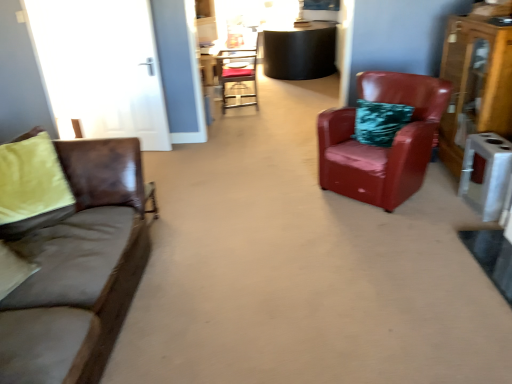
Question: From a real-world perspective, is brown leather couch at left located beneath wooden dresser at right?

Choices:
 (A) no
 (B) yes

Answer: (B)

Question: Can you confirm if brown leather couch at left is bigger than wooden dresser at right?

Choices:
 (A) yes
 (B) no

Answer: (A)

Question: Is wooden dresser at right a part of brown leather couch at left?

Choices:
 (A) yes
 (B) no

Answer: (B)

Question: From the image's perspective, is brown leather couch at left located above wooden dresser at right?

Choices:
 (A) no
 (B) yes

Answer: (A)

Question: Is brown leather couch at left oriented towards wooden dresser at right?

Choices:
 (A) no
 (B) yes

Answer: (B)

Question: In terms of width, does metallic silver chair at center, acting as the second chair starting from the front, look wider or thinner when compared to brown leather couch at left?

Choices:
 (A) thin
 (B) wide

Answer: (A)

Question: From the image's perspective, is metallic silver chair at center, which appears as the second chair when viewed from the right, positioned above or below brown leather couch at left?

Choices:
 (A) below
 (B) above

Answer: (B)

Question: Is point (227, 79) closer or farther from the camera than point (120, 251)?

Choices:
 (A) farther
 (B) closer

Answer: (A)

Question: Would you say metallic silver chair at center, which appears as the second chair when viewed from the right, is to the left or to the right of brown leather couch at left in the picture?

Choices:
 (A) right
 (B) left

Answer: (A)

Question: Considering the positions of leather armchair at right, which is the first chair in right-to-left order, and metallic silver chair at center, which appears as the second chair when viewed from the right, in the image, is leather armchair at right, which is the first chair in right-to-left order, taller or shorter than metallic silver chair at center, which appears as the second chair when viewed from the right,?

Choices:
 (A) tall
 (B) short

Answer: (B)

Question: Is point (318, 153) closer or farther from the camera than point (220, 77)?

Choices:
 (A) farther
 (B) closer

Answer: (B)

Question: Considering the positions of leather armchair at right, which ranks as the second chair in left-to-right order, and metallic silver chair at center, which appears as the second chair when viewed from the right, in the image, is leather armchair at right, which ranks as the second chair in left-to-right order, bigger or smaller than metallic silver chair at center, which appears as the second chair when viewed from the right,?

Choices:
 (A) big
 (B) small

Answer: (A)

Question: Is leather armchair at right, which is the first chair in right-to-left order, inside or outside of metallic silver chair at center, acting as the second chair starting from the front?

Choices:
 (A) inside
 (B) outside

Answer: (B)

Question: Looking at the image, does brown leather couch at left seem bigger or smaller compared to leather armchair at right, which ranks as the second chair in back-to-front order?

Choices:
 (A) small
 (B) big

Answer: (B)

Question: Is brown leather couch at left situated inside leather armchair at right, positioned as the 1th chair in bottom-to-top order, or outside?

Choices:
 (A) inside
 (B) outside

Answer: (B)